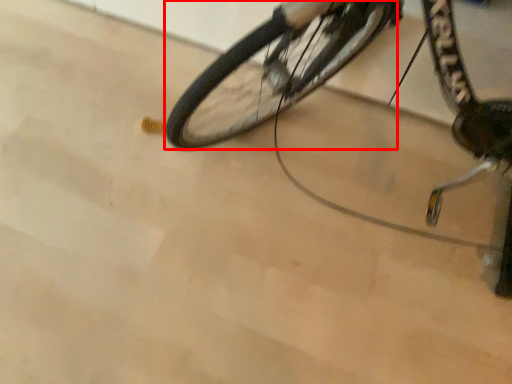
Question: From the image's perspective, considering the relative positions of bicycle wheel (annotated by the red box) and bicycle in the image provided, where is bicycle wheel (annotated by the red box) located with respect to the staircase?

Choices:
 (A) below
 (B) above

Answer: (B)